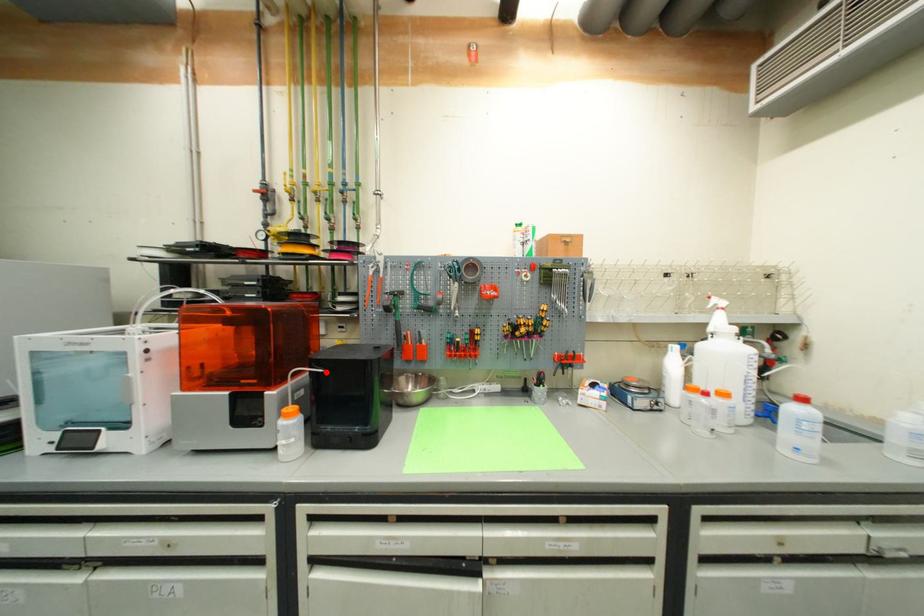
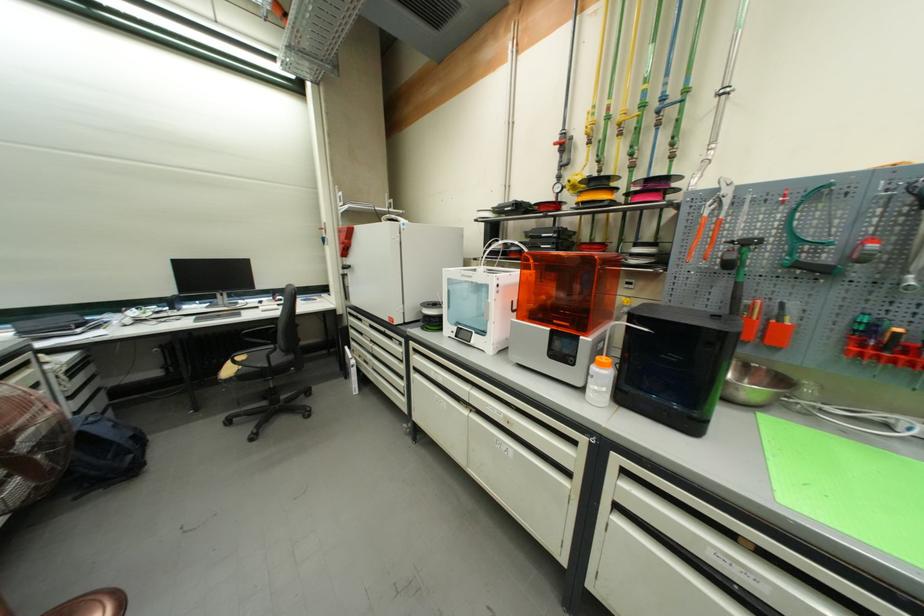
Where in the second image is the point corresponding to the highlighted location from the first image?

(651, 331)